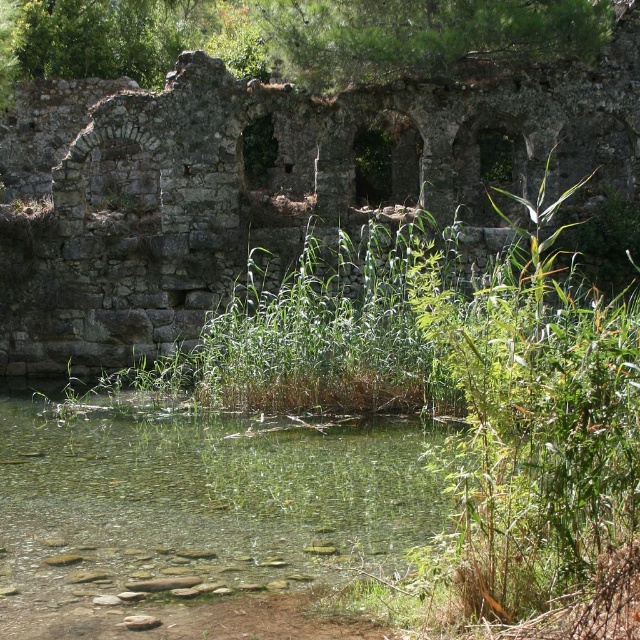
Question: Which point appears closest to the camera in this image?

Choices:
 (A) (161, 593)
 (B) (490, 26)

Answer: (A)

Question: Does rusty stone ruins at center have a lesser width compared to clear water at center?

Choices:
 (A) yes
 (B) no

Answer: (B)

Question: Based on their relative distances, which object is farther from the green leafy tree at upper center?

Choices:
 (A) rusty stone ruins at center
 (B) clear water at center

Answer: (B)

Question: Based on their relative distances, which object is farther from the clear water at center?

Choices:
 (A) green leafy tree at upper center
 (B) rusty stone ruins at center

Answer: (A)

Question: In this image, where is rusty stone ruins at center located relative to clear water at center?

Choices:
 (A) below
 (B) above

Answer: (B)

Question: Is rusty stone ruins at center in front of clear water at center?

Choices:
 (A) yes
 (B) no

Answer: (B)